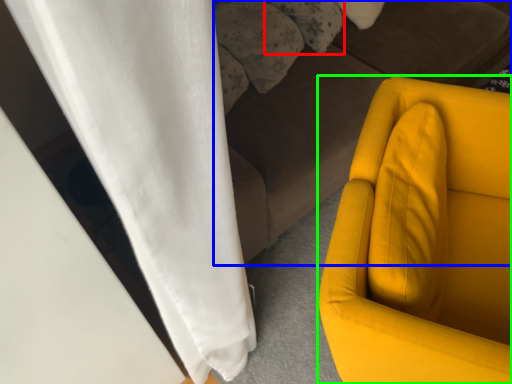
Question: Which object is the closest to the pillow (highlighted by a red box)? Choose among these: studio couch (highlighted by a blue box) or furniture (highlighted by a green box).

Choices:
 (A) studio couch
 (B) furniture

Answer: (A)